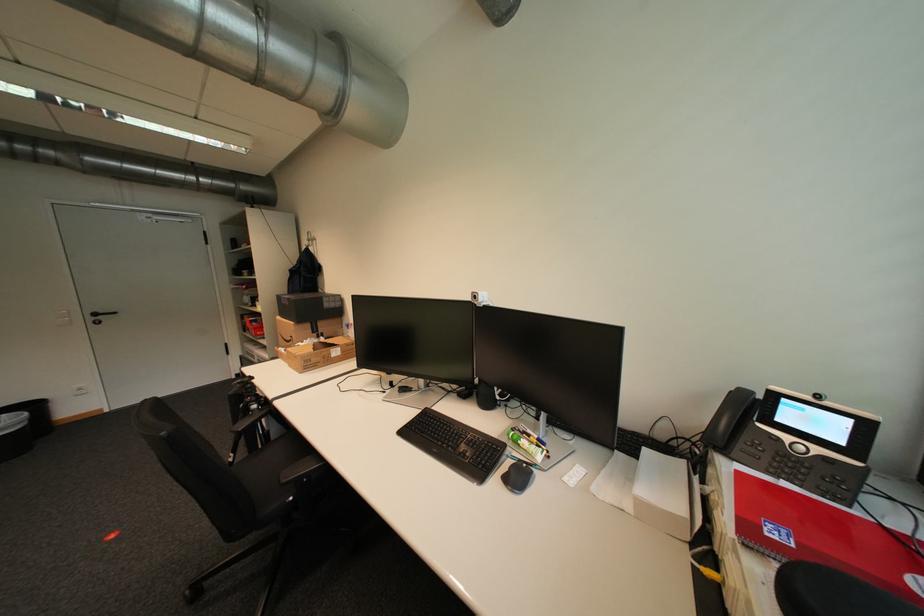
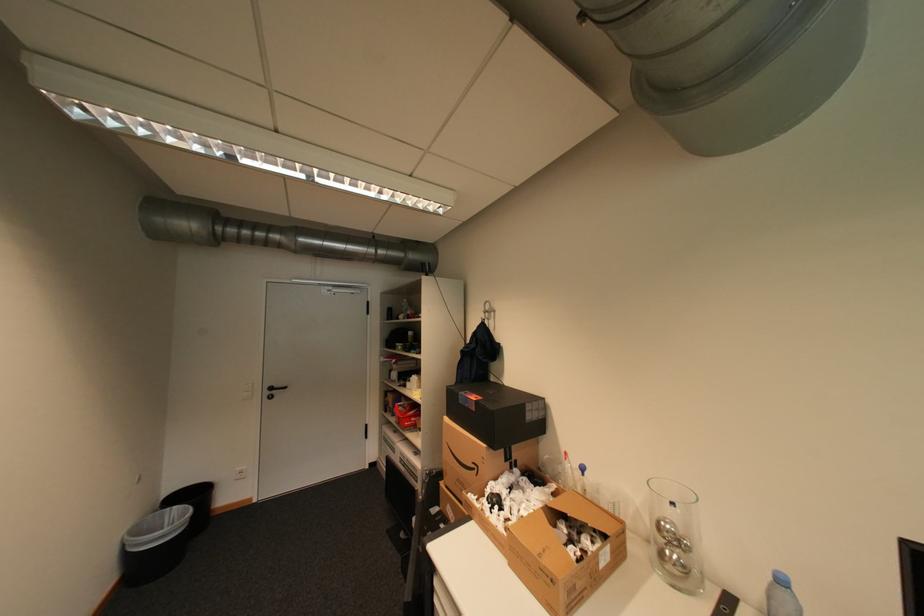
In the second image, find the point that corresponds to point (103, 315) in the first image.

(280, 389)